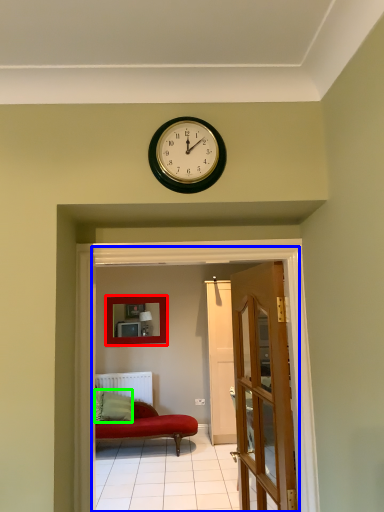
Question: Considering the real-world distances, which object is closest to picture frame (highlighted by a red box)? corridor (highlighted by a blue box) or pillow (highlighted by a green box).

Choices:
 (A) corridor
 (B) pillow

Answer: (B)